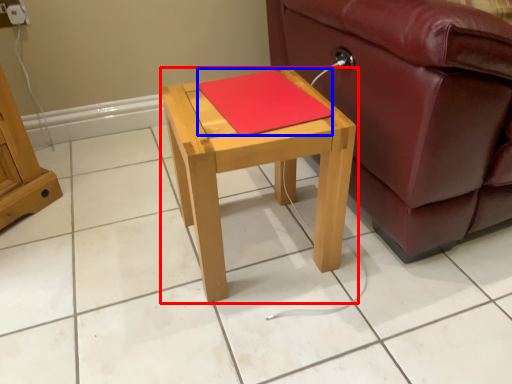
Question: Which of the following is the farthest to the observer, table (highlighted by a red box) or pad (highlighted by a blue box)?

Choices:
 (A) table
 (B) pad

Answer: (B)